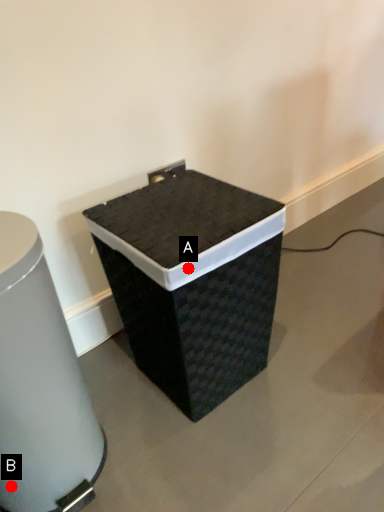
Question: Two points are circled on the image, labeled by A and B beside each circle. Which point is closer to the camera?

Choices:
 (A) A is closer
 (B) B is closer

Answer: (A)